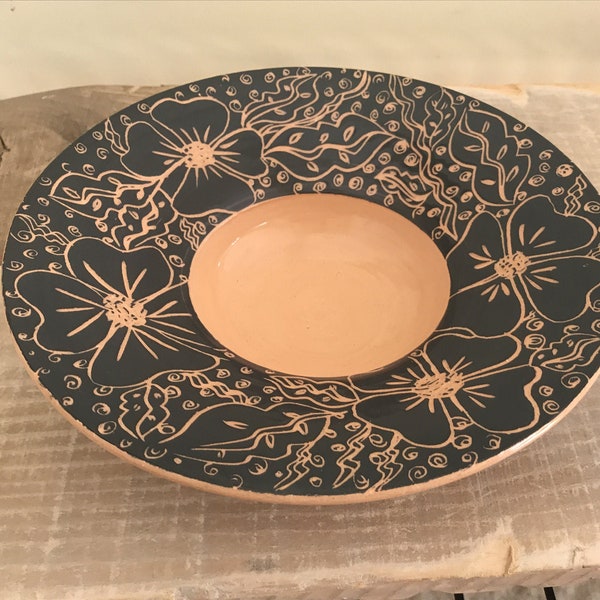
Identify the location of floor or wall. (340, 43).